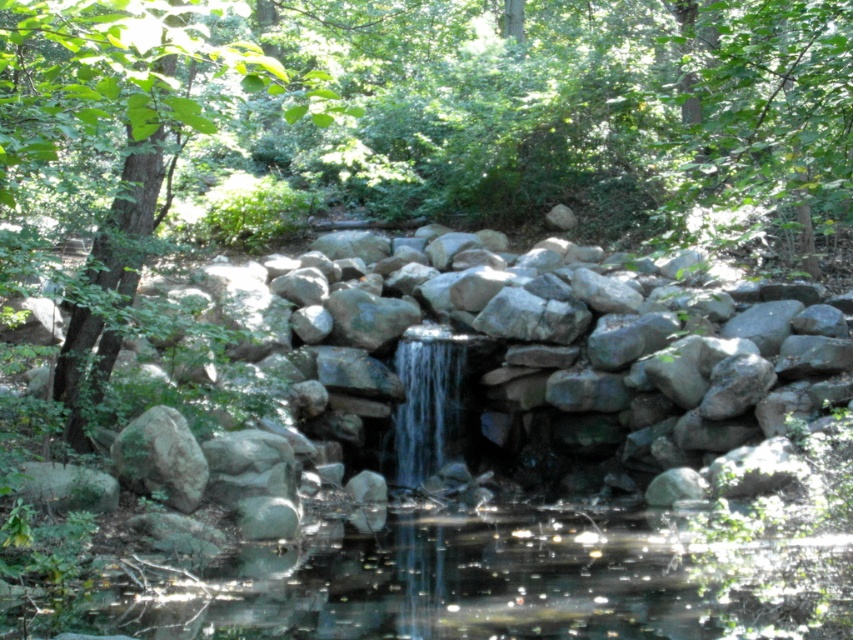
You are a hiker standing at the edge of the waterfall. You notice the clear water at center and the green leafy tree at upper center. Which one appears narrower from your perspective?

The clear water at center appears narrower because its width is less than that of the green leafy tree at upper center.